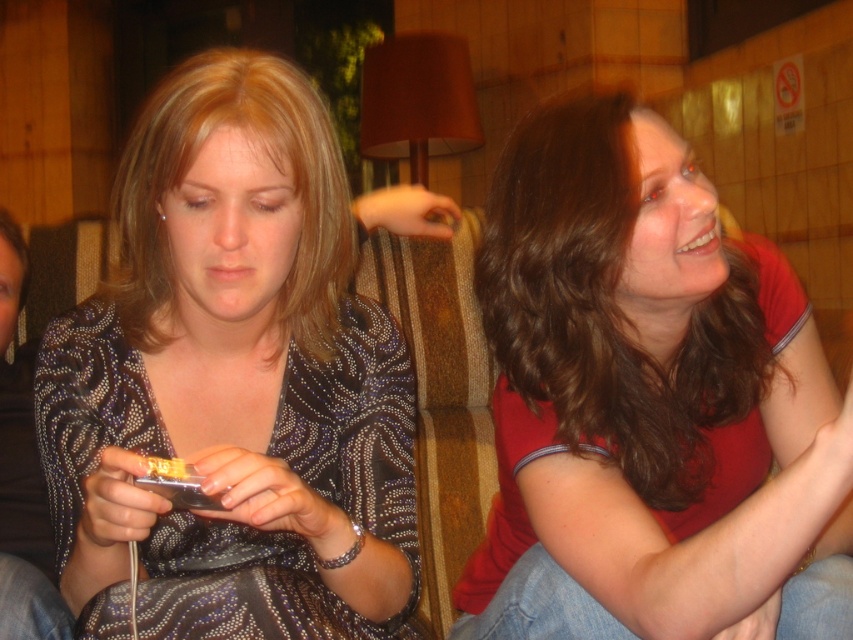
Is sparkly dark blue dress at center below matte gold phone at lower left?

Incorrect, sparkly dark blue dress at center is not positioned below matte gold phone at lower left.

Does point (294, 260) come farther from viewer compared to point (166, 468)?

Yes, point (294, 260) is farther from viewer.

The height and width of the screenshot is (640, 853). Identify the location of sparkly dark blue dress at center. (233, 381).

Which is behind, point (656, 211) or point (192, 86)?

The point (656, 211) is more distant.

Is matte red shirt at right taller than matte black dress at center?

Indeed, matte red shirt at right has a greater height compared to matte black dress at center.

Is point (711, 424) positioned in front of point (120, 276)?

No.

At what (x,y) coordinates should I click in order to perform the action: click on matte red shirt at right. Please return your answer as a coordinate pair (x, y). This screenshot has width=853, height=640. Looking at the image, I should click on (648, 403).

Between matte red shirt at right and matte gold phone at lower left, which one appears on the right side from the viewer's perspective?

matte red shirt at right

Which is behind, point (633, 486) or point (181, 472)?

Positioned behind is point (633, 486).

Does point (670, 422) come behind point (154, 461)?

Yes, point (670, 422) is behind point (154, 461).

Where is `matte red shirt at right`? The height and width of the screenshot is (640, 853). matte red shirt at right is located at coordinates (648, 403).